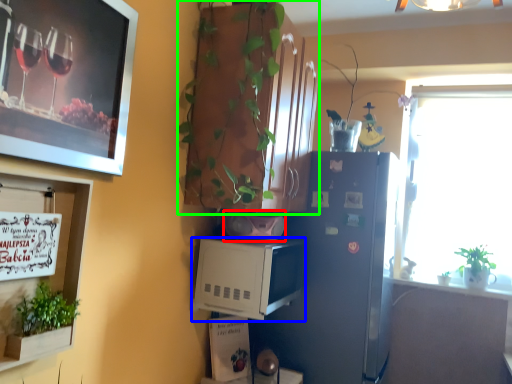
Question: Which object is positioned closest to appliance (highlighted by a red box)? Select from appliance (highlighted by a blue box) and cabinetry (highlighted by a green box).

Choices:
 (A) appliance
 (B) cabinetry

Answer: (A)